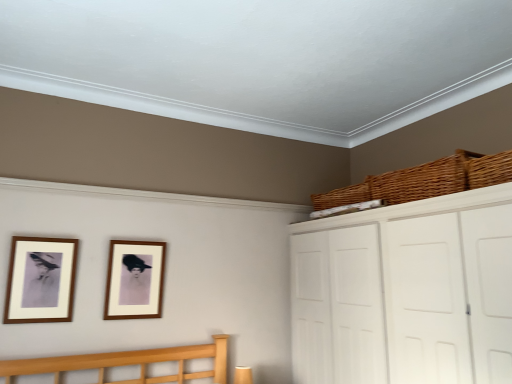
Question: From the image's perspective, is woven brown basket at upper right, arranged as the second basket when viewed from the front, above or below wooden picture frame at center, marked as the second picture frame in a left-to-right arrangement?

Choices:
 (A) above
 (B) below

Answer: (A)

Question: From a real-world perspective, is woven brown basket at upper right, placed as the second basket when sorted from back to front, physically located above or below wooden picture frame at center, marked as the second picture frame in a left-to-right arrangement?

Choices:
 (A) above
 (B) below

Answer: (A)

Question: Considering the real-world distances, which object is farthest from the white matte cabinet at upper right?

Choices:
 (A) woven brown basket at upper right, placed as the second basket when sorted from back to front
 (B) wooden picture frame at center, the second picture frame positioned from the front
 (C) woven brown basket at upper right, which appears as the 3th basket when viewed from the front
 (D) woven brown basket at upper right, acting as the third basket starting from the back
 (E) matte wood picture frame at left, the 2th picture frame from the back

Answer: (E)

Question: Considering the real-world distances, which object is farthest from the woven brown basket at upper right, which appears as the 3th basket when viewed from the front?

Choices:
 (A) woven brown basket at upper right, placed as the second basket when sorted from back to front
 (B) white matte cabinet at upper right
 (C) wooden picture frame at center, the second picture frame positioned from the front
 (D) matte wood picture frame at left, arranged as the 1th picture frame when viewed from the left
 (E) woven brown basket at upper right, acting as the third basket starting from the back

Answer: (D)